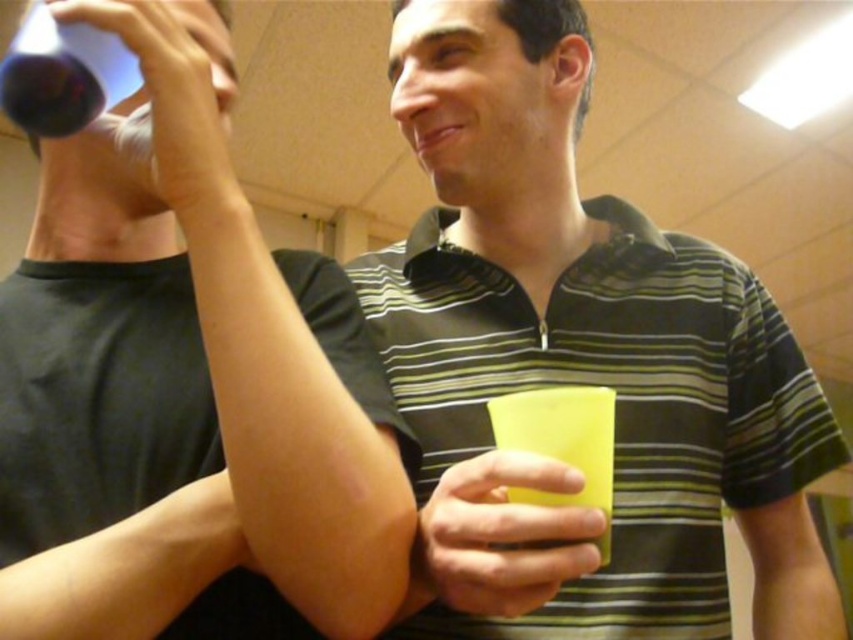
Identify the location of matte plastic cup at upper left. (146, 96).

Between point (99, 10) and point (572, 397), which one is positioned behind?

The point (99, 10) is more distant.

Is point (55, 148) positioned before point (602, 554)?

That is False.

At what (x,y) coordinates should I click in order to perform the action: click on matte plastic cup at upper left. Please return your answer as a coordinate pair (x, y). This screenshot has width=853, height=640. Looking at the image, I should click on (146, 96).

Does point (473, 460) lie behind point (0, 86)?

That is False.

Looking at this image, is yellow matte cup at lower center wider than translucent plastic cup at upper left?

In fact, yellow matte cup at lower center might be narrower than translucent plastic cup at upper left.

Identify the location of yellow matte cup at lower center. (502, 536).

Which is more to the left, matte green cup at right or yellow matte cup at center?

From the viewer's perspective, matte green cup at right appears more on the left side.

Describe the element at coordinates (186, 387) in the screenshot. I see `matte green cup at right` at that location.

Between point (344, 436) and point (573, 502), which one is positioned behind?

Point (344, 436)

This screenshot has height=640, width=853. I want to click on matte green cup at right, so click(186, 387).